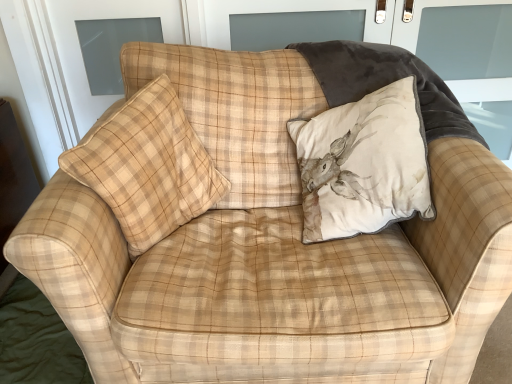
Question: Is beige velvet cushion with deer print at upper right, acting as the 2th pillow starting from the left, wider than velvet screen door at upper right?

Choices:
 (A) yes
 (B) no

Answer: (A)

Question: Is beige velvet cushion with deer print at upper right, the first pillow viewed from the right, positioned beyond the bounds of velvet screen door at upper right?

Choices:
 (A) yes
 (B) no

Answer: (A)

Question: From the image's perspective, would you say beige velvet cushion with deer print at upper right, the first pillow viewed from the right, is positioned over velvet screen door at upper right?

Choices:
 (A) no
 (B) yes

Answer: (A)

Question: Does beige velvet cushion with deer print at upper right, the first pillow viewed from the right, contain velvet screen door at upper right?

Choices:
 (A) yes
 (B) no

Answer: (B)

Question: Is beige velvet cushion with deer print at upper right, the first pillow viewed from the right, thinner than velvet screen door at upper right?

Choices:
 (A) no
 (B) yes

Answer: (A)

Question: Considering the relative positions of beige plaid pillow at center, placed as the first pillow when sorted from left to right, and beige velvet cushion with deer print at upper right, the first pillow viewed from the right, in the image provided, is beige plaid pillow at center, placed as the first pillow when sorted from left to right, to the left or to the right of beige velvet cushion with deer print at upper right, the first pillow viewed from the right,?

Choices:
 (A) left
 (B) right

Answer: (A)

Question: Is beige plaid pillow at center, placed as the first pillow when sorted from left to right, in front of or behind beige velvet cushion with deer print at upper right, the first pillow viewed from the right, in the image?

Choices:
 (A) front
 (B) behind

Answer: (A)

Question: In terms of height, does beige plaid pillow at center, placed as the first pillow when sorted from left to right, look taller or shorter compared to beige velvet cushion with deer print at upper right, the first pillow viewed from the right?

Choices:
 (A) tall
 (B) short

Answer: (A)

Question: Is point (203, 190) positioned closer to the camera than point (314, 193)?

Choices:
 (A) closer
 (B) farther

Answer: (B)

Question: Relative to velvet screen door at upper right, is beige plaid pillow at center, placed as the first pillow when sorted from left to right, in front or behind?

Choices:
 (A) behind
 (B) front

Answer: (B)

Question: Is beige plaid pillow at center, marked as the 2th pillow in a right-to-left arrangement, taller or shorter than velvet screen door at upper right?

Choices:
 (A) short
 (B) tall

Answer: (A)

Question: Is beige plaid pillow at center, marked as the 2th pillow in a right-to-left arrangement, inside or outside of velvet screen door at upper right?

Choices:
 (A) inside
 (B) outside

Answer: (B)

Question: From the image's perspective, is beige plaid pillow at center, marked as the 2th pillow in a right-to-left arrangement, located above or below velvet screen door at upper right?

Choices:
 (A) below
 (B) above

Answer: (A)

Question: Does point (416, 1) appear closer or farther from the camera than point (387, 137)?

Choices:
 (A) closer
 (B) farther

Answer: (B)

Question: Is velvet screen door at upper right wider or thinner than beige velvet cushion with deer print at upper right, acting as the 2th pillow starting from the left?

Choices:
 (A) thin
 (B) wide

Answer: (A)